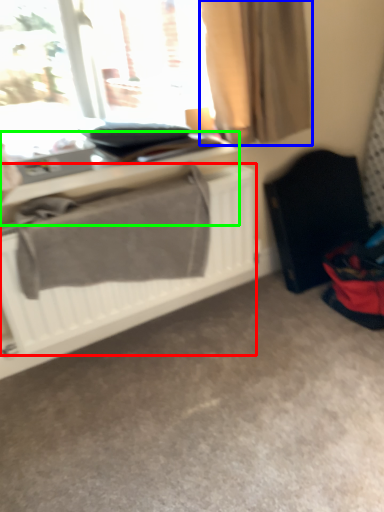
Question: Based on their relative distances, which object is nearer to radiator (highlighted by a red box)? Choose from curtain (highlighted by a blue box) and table (highlighted by a green box).

Choices:
 (A) curtain
 (B) table

Answer: (B)